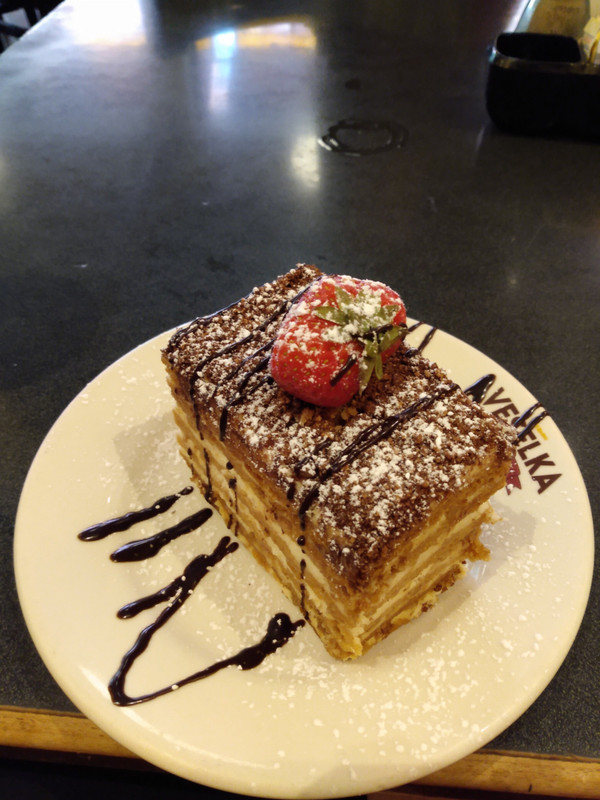
You are a GUI agent. You are given a task and a screenshot of the screen. Output one action in this format:
    pyautogui.click(x=<x>, y=<y>)
    Task: Click on the wood trim
    The width and height of the screenshot is (600, 800).
    Given the screenshot: What is the action you would take?
    pyautogui.click(x=536, y=773)